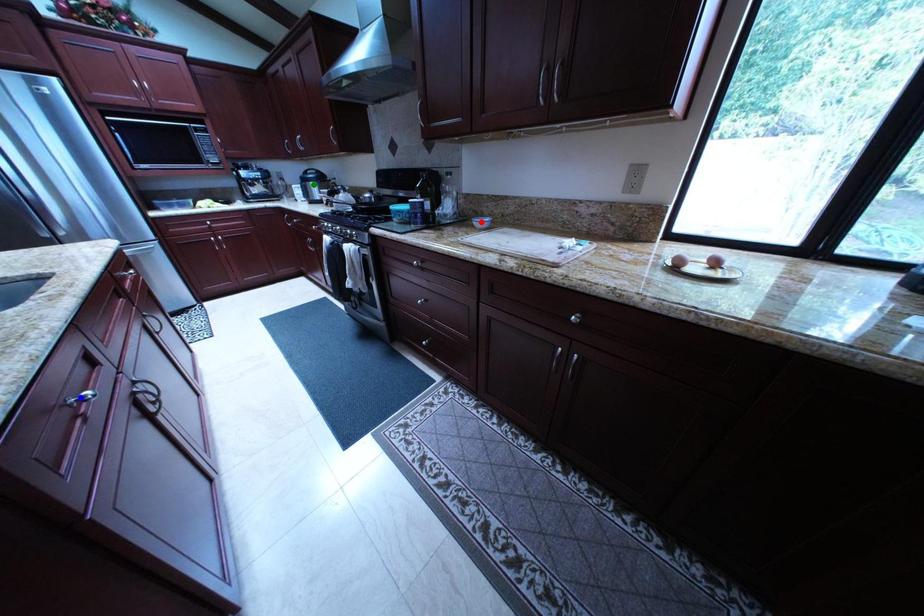
Order these from nearest to farthest:
A) blue point
B) green point
C) red point

blue point, red point, green point